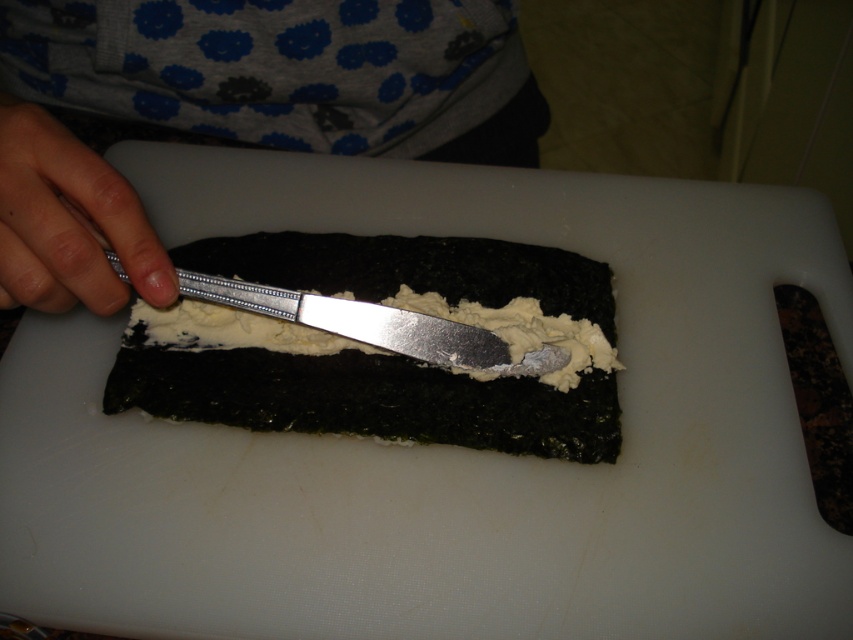
Is gray fabric at upper center below smooth white cream at center?

No, gray fabric at upper center is not below smooth white cream at center.

What do you see at coordinates (231, 109) in the screenshot?
I see `gray fabric at upper center` at bounding box center [231, 109].

Does point (18, 216) come closer to viewer compared to point (254, 259)?

Yes, it is.

Locate an element on the screen. The image size is (853, 640). gray fabric at upper center is located at coordinates (231, 109).

Is gray fabric at upper center behind pale skin at knife left?

Yes, it is behind pale skin at knife left.

Can you confirm if gray fabric at upper center is positioned above pale skin at knife left?

Indeed, gray fabric at upper center is positioned over pale skin at knife left.

This screenshot has height=640, width=853. I want to click on gray fabric at upper center, so click(x=231, y=109).

You are a GUI agent. You are given a task and a screenshot of the screen. Output one action in this format:
    pyautogui.click(x=<x>, y=<y>)
    Task: Click on the gray fabric at upper center
    Image resolution: width=853 pixels, height=640 pixels.
    Given the screenshot: What is the action you would take?
    pyautogui.click(x=231, y=109)

Can you confirm if smooth white cream at center is shorter than pale skin at knife left?

No, smooth white cream at center is not shorter than pale skin at knife left.

Does point (469, 433) lie in front of point (44, 244)?

No, it is not.

Does point (344, 403) lie behind point (175, 298)?

That is True.

Find the location of `smooth white cream at center`. smooth white cream at center is located at coordinates (364, 401).